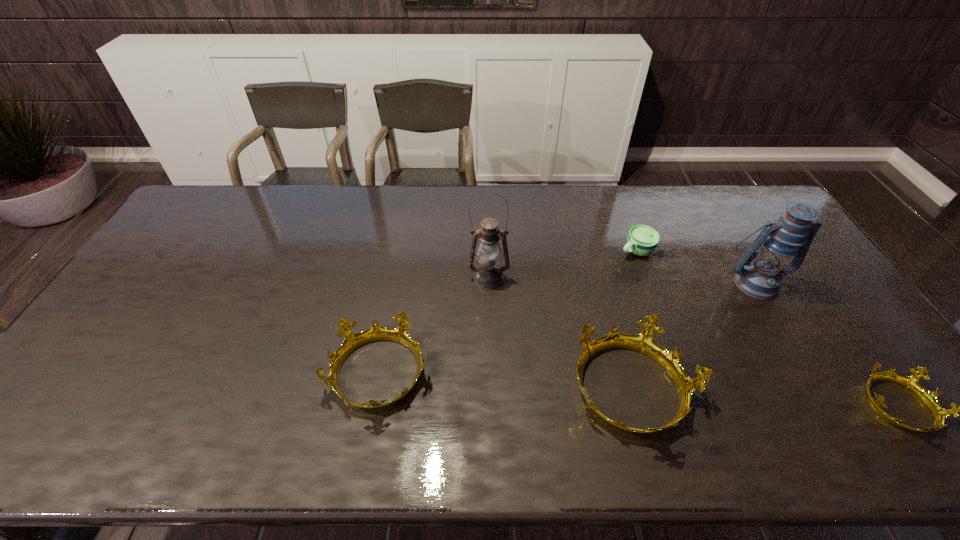
Where is `free space between the lantern and the second tallest crown`? free space between the lantern and the second tallest crown is located at coordinates (567, 328).

In order to click on free spot between the second crown from left to right and the oil lamp in this screenshot , I will do `click(561, 334)`.

This screenshot has width=960, height=540. What are the coordinates of `vacant area that lies between the third shortest object and the second crown from left to right` in the screenshot? It's located at (506, 382).

I want to click on unoccupied position between the second crown from right to left and the leftmost object, so click(x=506, y=382).

This screenshot has width=960, height=540. Identify the location of vacant point located between the cup and the leftmost crown. pyautogui.click(x=508, y=313).

You are a GUI agent. You are given a task and a screenshot of the screen. Output one action in this format:
    pyautogui.click(x=<x>, y=<y>)
    Task: Click on the object that stands as the fifth closest to the oil lamp
    
    Given the screenshot: What is the action you would take?
    pyautogui.click(x=939, y=414)

The height and width of the screenshot is (540, 960). I want to click on object that is the fourth nearest to the lantern, so click(x=488, y=275).

Identify the location of crown that can be found as the second closest to the lantern. The width and height of the screenshot is (960, 540). (644, 343).

Locate which crown ranks in proximity to the leftmost object. Please provide its 2D coordinates. Your answer should be formatted as a tuple, i.e. [(x, y)], where the tuple contains the x and y coordinates of a point satisfying the conditions above.

[(644, 343)]